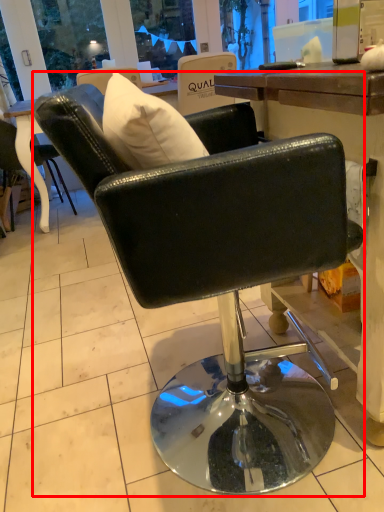
Question: From the image's perspective, what is the correct spatial relationship of chair (annotated by the red box) in relation to chair?

Choices:
 (A) below
 (B) above

Answer: (A)